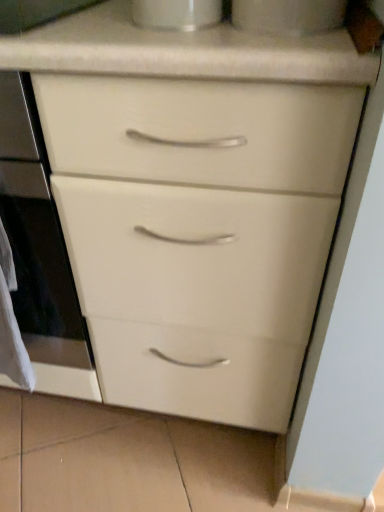
Question: Based on their sizes in the image, would you say white paper at left is bigger or smaller than white glossy cup at upper center, arranged as the 1th appliance when viewed from the right?

Choices:
 (A) big
 (B) small

Answer: (B)

Question: Would you say white paper at left is to the left or to the right of white glossy cup at upper center, the second appliance viewed from the left, in the picture?

Choices:
 (A) left
 (B) right

Answer: (A)

Question: Estimate the real-world distances between objects in this image. Which object is farther from the white glossy oven at center?

Choices:
 (A) white glossy cup at upper center, the second appliance viewed from the left
 (B) white glossy cup at upper center, marked as the second appliance in a right-to-left arrangement
 (C) white paper at left

Answer: (A)

Question: Based on their relative distances, which object is nearer to the white paper at left?

Choices:
 (A) white glossy cup at upper center, arranged as the 1th appliance when viewed from the right
 (B) white glossy cup at upper center, which appears as the 1th appliance when viewed from the left
 (C) white glossy oven at center

Answer: (C)